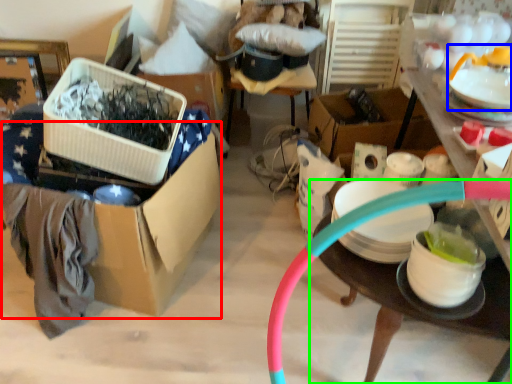
Question: Which object is positioned closest to storage box (highlighted by a red box)? Select from tableware (highlighted by a blue box) and table (highlighted by a green box).

Choices:
 (A) tableware
 (B) table

Answer: (B)